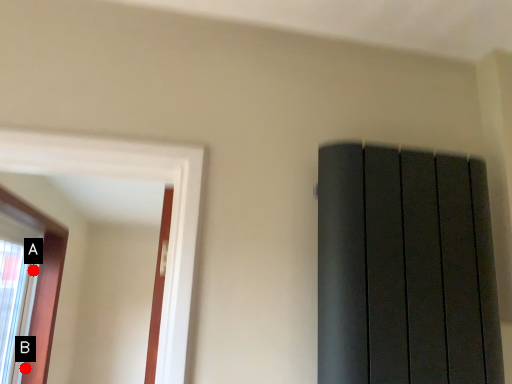
Question: Two points are circled on the image, labeled by A and B beside each circle. Which of the following is the farthest from the observer?

Choices:
 (A) A is further
 (B) B is further

Answer: (A)